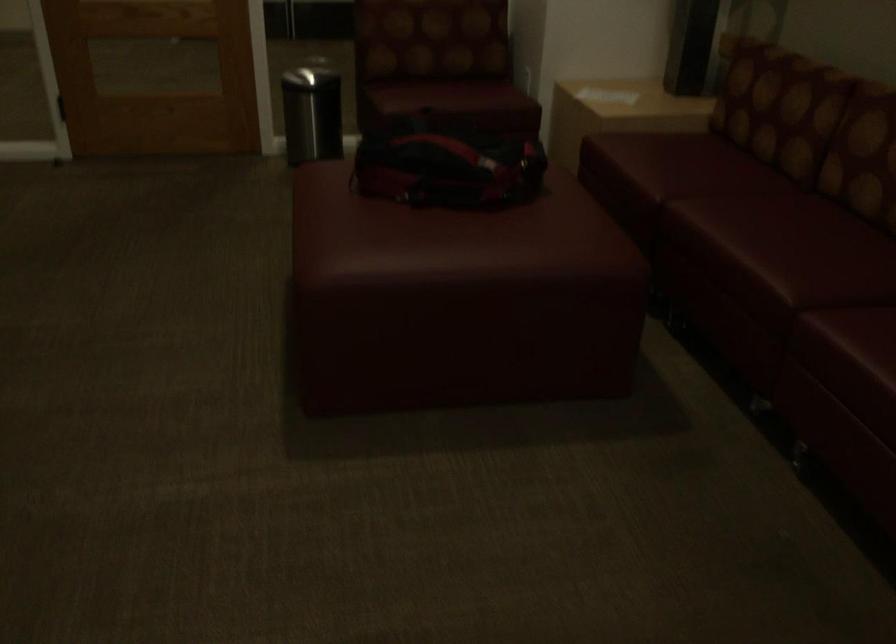
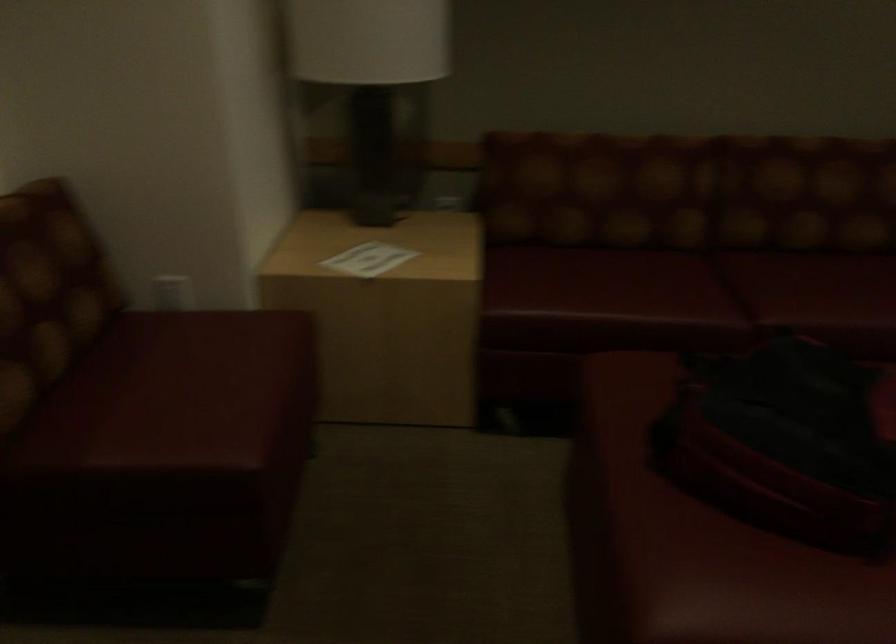
Where in the second image is the point corresponding to point 359,166 from the first image?

(693, 541)